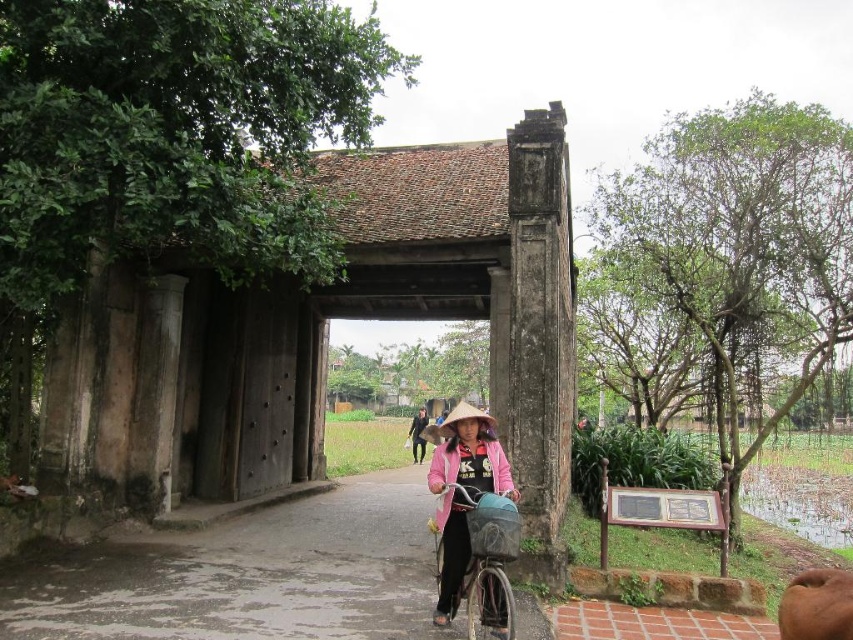
Which is below, brown straw hat at center or black matte jacket at center?

black matte jacket at center is below.

Is point (451, 416) positioned behind point (410, 433)?

No, it is not.

Locate an element on the screen. This screenshot has width=853, height=640. brown straw hat at center is located at coordinates (465, 419).

What do you see at coordinates (486, 561) in the screenshot?
I see `metallic silver bicycle at center` at bounding box center [486, 561].

The image size is (853, 640). What do you see at coordinates (486, 561) in the screenshot?
I see `metallic silver bicycle at center` at bounding box center [486, 561].

The width and height of the screenshot is (853, 640). What are the coordinates of `metallic silver bicycle at center` in the screenshot? It's located at (486, 561).

Looking at this image, does metallic silver bicycle at center appear under brown straw hat at center?

Indeed, metallic silver bicycle at center is positioned under brown straw hat at center.

From the picture: Can you confirm if metallic silver bicycle at center is positioned above brown straw hat at center?

Incorrect, metallic silver bicycle at center is not positioned above brown straw hat at center.

Image resolution: width=853 pixels, height=640 pixels. Find the location of `metallic silver bicycle at center`. metallic silver bicycle at center is located at coordinates (486, 561).